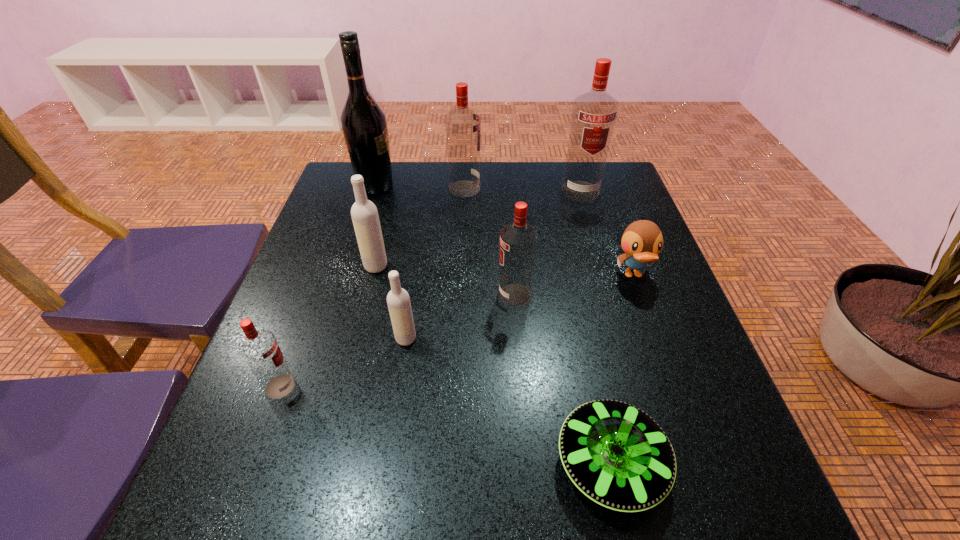
Locate an element on the screen. This screenshot has height=540, width=960. vacant space that satisfies the following two spatial constraints: 1. on the front label of the green saucer; 2. on the right side of the leftmost vodka is located at coordinates (252, 463).

Find the location of a particular element. This screenshot has height=540, width=960. free location that satisfies the following two spatial constraints: 1. on the front-facing side of the second shortest object; 2. on the front label of the sixth object from left to right is located at coordinates (640, 295).

At what (x,y) coordinates should I click in order to perform the action: click on vacant space that satisfies the following two spatial constraints: 1. on the front label of the leftmost red vodka; 2. on the left side of the nearest object. Please return your answer as a coordinate pair (x, y). The width and height of the screenshot is (960, 540). Looking at the image, I should click on pyautogui.click(x=252, y=463).